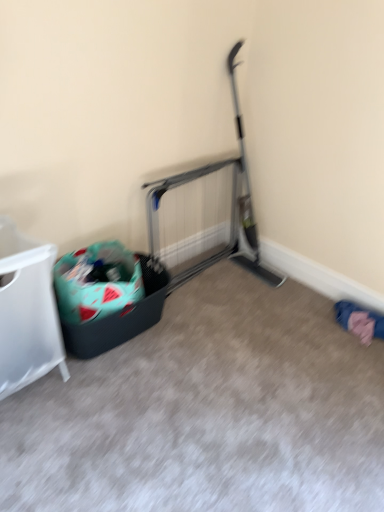
Question: From a real-world perspective, is teal fabric recycling bin at left physically below white plastic laundry basket at left?

Choices:
 (A) no
 (B) yes

Answer: (B)

Question: Is teal fabric recycling bin at left thinner than white plastic laundry basket at left?

Choices:
 (A) no
 (B) yes

Answer: (A)

Question: Is teal fabric recycling bin at left positioned far away from white plastic laundry basket at left?

Choices:
 (A) no
 (B) yes

Answer: (A)

Question: Is teal fabric recycling bin at left wider than white plastic laundry basket at left?

Choices:
 (A) yes
 (B) no

Answer: (A)

Question: From the image's perspective, is teal fabric recycling bin at left below white plastic laundry basket at left?

Choices:
 (A) no
 (B) yes

Answer: (B)

Question: Considering the relative positions of teal fabric recycling bin at left and white plastic laundry basket at left in the image provided, is teal fabric recycling bin at left in front of white plastic laundry basket at left?

Choices:
 (A) no
 (B) yes

Answer: (A)

Question: Is pink fabric at lower right at the left side of white plastic laundry basket at left?

Choices:
 (A) yes
 (B) no

Answer: (B)

Question: Is pink fabric at lower right completely or partially outside of white plastic laundry basket at left?

Choices:
 (A) yes
 (B) no

Answer: (A)

Question: Does pink fabric at lower right have a smaller size compared to white plastic laundry basket at left?

Choices:
 (A) yes
 (B) no

Answer: (A)

Question: Can you confirm if pink fabric at lower right is shorter than white plastic laundry basket at left?

Choices:
 (A) no
 (B) yes

Answer: (B)

Question: Does pink fabric at lower right have a lesser width compared to white plastic laundry basket at left?

Choices:
 (A) no
 (B) yes

Answer: (B)

Question: Is the depth of pink fabric at lower right greater than that of white plastic laundry basket at left?

Choices:
 (A) yes
 (B) no

Answer: (A)

Question: Does teal fabric recycling bin at left have a greater width compared to pink fabric at lower right?

Choices:
 (A) no
 (B) yes

Answer: (B)